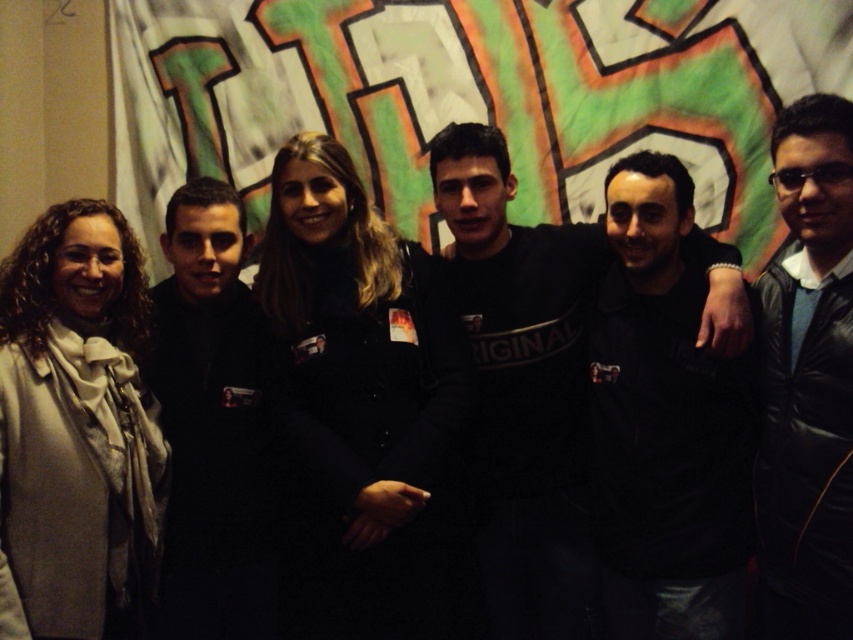
Question: Which of the following is the farthest from the observer?

Choices:
 (A) white soft scarf at left
 (B) black matte jacket at left

Answer: (B)

Question: Which object is the farthest from the white soft scarf at left?

Choices:
 (A) black matte jacket at left
 (B) black fabric at center
 (C) black matte shirt at center
 (D) black leather jacket at right

Answer: (D)

Question: Can you confirm if black fabric at center is bigger than black leather jacket at right?

Choices:
 (A) yes
 (B) no

Answer: (A)

Question: Does black fabric at center have a lesser width compared to white soft scarf at left?

Choices:
 (A) yes
 (B) no

Answer: (B)

Question: Among these points, which one is farthest from the camera?

Choices:
 (A) (833, 608)
 (B) (434, 529)
 (C) (583, 467)
 (D) (155, 300)

Answer: (D)

Question: Is white soft scarf at left further to camera compared to black matte jacket at left?

Choices:
 (A) no
 (B) yes

Answer: (A)